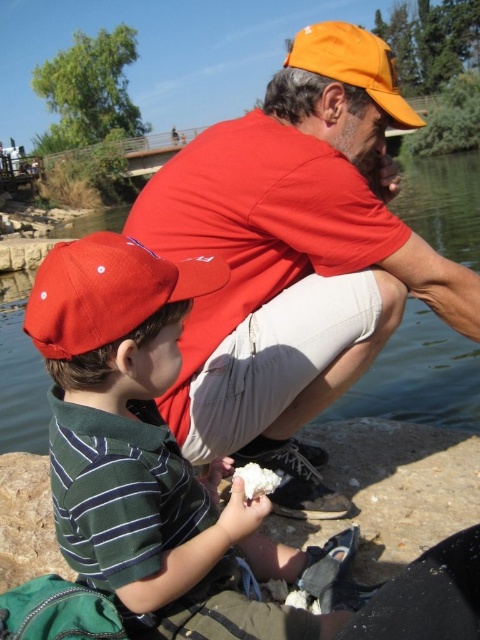
Question: Among these objects, which one is nearest to the camera?

Choices:
 (A) orange fabric baseball cap at upper center
 (B) green striped shirt at lower left
 (C) orange cotton cap at upper center
 (D) matte red baseball cap at left

Answer: (B)

Question: Which object appears farthest from the camera in this image?

Choices:
 (A) orange cotton cap at upper center
 (B) orange fabric baseball cap at upper center
 (C) matte red baseball cap at left
 (D) green striped shirt at lower left

Answer: (B)

Question: Can you confirm if green striped shirt at lower left is positioned to the right of orange fabric baseball cap at upper center?

Choices:
 (A) no
 (B) yes

Answer: (A)

Question: Is orange cotton cap at upper center wider than green striped shirt at lower left?

Choices:
 (A) no
 (B) yes

Answer: (B)

Question: Which object is positioned farthest from the orange fabric baseball cap at upper center?

Choices:
 (A) matte red baseball cap at left
 (B) green striped shirt at lower left

Answer: (A)

Question: Can you confirm if green striped shirt at lower left is positioned to the left of orange fabric baseball cap at upper center?

Choices:
 (A) no
 (B) yes

Answer: (B)